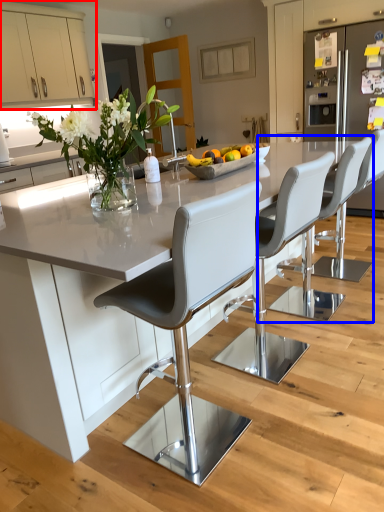
Question: Among these objects, which one is farthest to the camera, cabinetry (highlighted by a red box) or chair (highlighted by a blue box)?

Choices:
 (A) cabinetry
 (B) chair

Answer: (A)